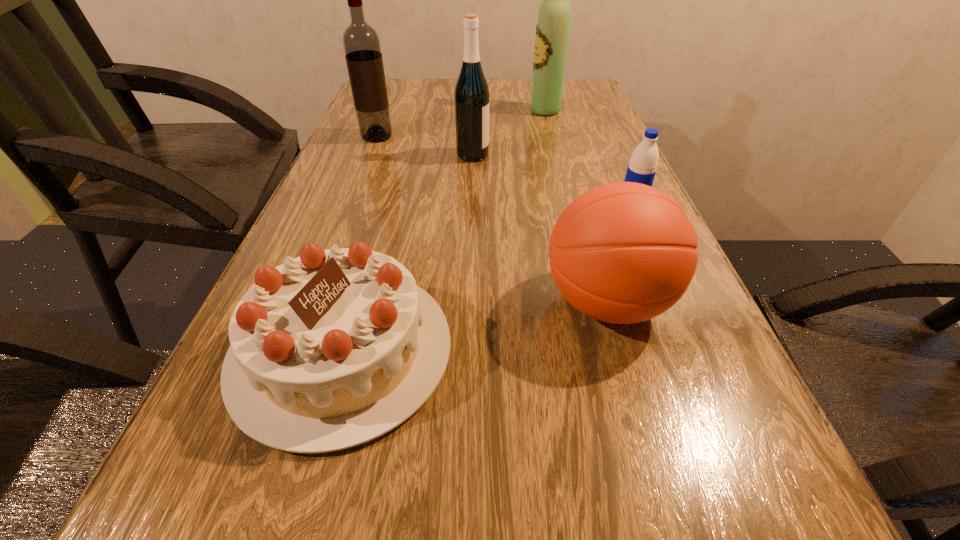
Identify the location of vacant space in between the nearest wine bottle and the third shortest object. Image resolution: width=960 pixels, height=540 pixels. [x=540, y=228].

What are the coordinates of `free space between the third nearest object and the birthday cake` in the screenshot? It's located at (488, 277).

The width and height of the screenshot is (960, 540). Identify the location of free space between the fourth tallest object and the birthday cake. (474, 326).

This screenshot has width=960, height=540. What are the coordinates of `free space between the fourth tallest object and the leftmost wine bottle` in the screenshot? It's located at coord(492,219).

Locate an element on the screen. The image size is (960, 540). free area in between the third nearest object and the birthday cake is located at coordinates (488, 277).

Locate an element on the screen. free space between the fourth shortest object and the birthday cake is located at coordinates (407, 253).

Select which object is the second closest to the fourth shortest object. Please provide its 2D coordinates. Your answer should be formatted as a tuple, i.e. [(x, y)], where the tuple contains the x and y coordinates of a point satisfying the conditions above.

[(553, 25)]

Where is `object that is the second closest to the farthest object`? Image resolution: width=960 pixels, height=540 pixels. object that is the second closest to the farthest object is located at coordinates (361, 43).

Select which wine bottle is the closest to the farthest wine bottle. Please provide its 2D coordinates. Your answer should be formatted as a tuple, i.e. [(x, y)], where the tuple contains the x and y coordinates of a point satisfying the conditions above.

[(471, 96)]

Locate an element on the screen. The image size is (960, 540). wine bottle object that ranks as the closest to the leftmost wine bottle is located at coordinates (471, 96).